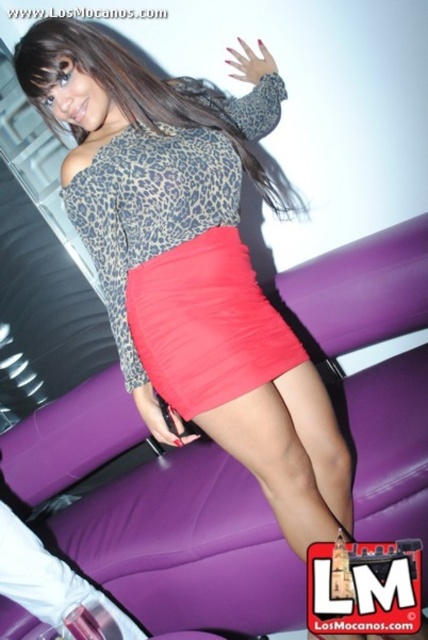
Question: Which object appears closest to the camera in this image?

Choices:
 (A) shiny coral skirt at center
 (B) leopard print dress at center
 (C) matte red skirt at center

Answer: (C)

Question: Based on their relative distances, which object is nearer to the leopard print dress at center?

Choices:
 (A) shiny coral skirt at center
 (B) matte red skirt at center

Answer: (B)

Question: Which object is the farthest from the shiny coral skirt at center?

Choices:
 (A) leopard print dress at center
 (B) matte red skirt at center

Answer: (A)

Question: Does matte red skirt at center lie in front of shiny coral skirt at center?

Choices:
 (A) no
 (B) yes

Answer: (B)

Question: In this image, where is shiny coral skirt at center located relative to leopard print dress at center?

Choices:
 (A) above
 (B) below

Answer: (B)

Question: Is shiny coral skirt at center positioned in front of leopard print dress at center?

Choices:
 (A) yes
 (B) no

Answer: (B)